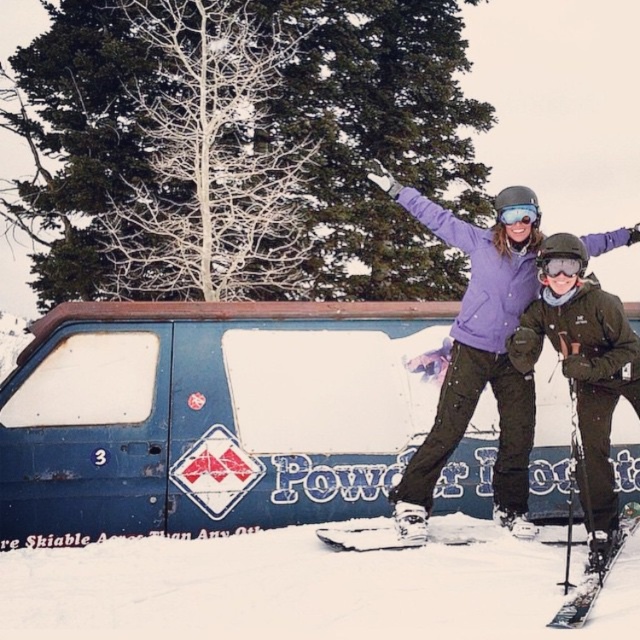
Find the location of `matte purple jacket at center`. matte purple jacket at center is located at coordinates (586, 378).

Which is more to the left, matte purple jacket at center or matte black goggles at upper center?

matte black goggles at upper center is more to the left.

You are a GUI agent. You are given a task and a screenshot of the screen. Output one action in this format:
    pyautogui.click(x=<x>, y=<y>)
    Task: Click on the matte purple jacket at center
    
    Given the screenshot: What is the action you would take?
    pyautogui.click(x=586, y=378)

Does blue matte van at center have a larger size compared to shiny black ski at lower right?

Indeed, blue matte van at center has a larger size compared to shiny black ski at lower right.

Who is positioned more to the right, blue matte van at center or shiny black ski at lower right?

From the viewer's perspective, shiny black ski at lower right appears more on the right side.

Does point (88, 538) lie in front of point (636, 508)?

Yes, it is.

At what (x,y) coordinates should I click in order to perform the action: click on blue matte van at center. Please return your answer as a coordinate pair (x, y). The width and height of the screenshot is (640, 640). Looking at the image, I should click on (209, 417).

Between blue matte van at center and transparent plastic goggles at center, which one appears on the right side from the viewer's perspective?

Positioned to the right is transparent plastic goggles at center.

Between point (33, 474) and point (580, 273), which one is positioned behind?

Point (33, 474)

Where is `blue matte van at center`? The height and width of the screenshot is (640, 640). blue matte van at center is located at coordinates (209, 417).